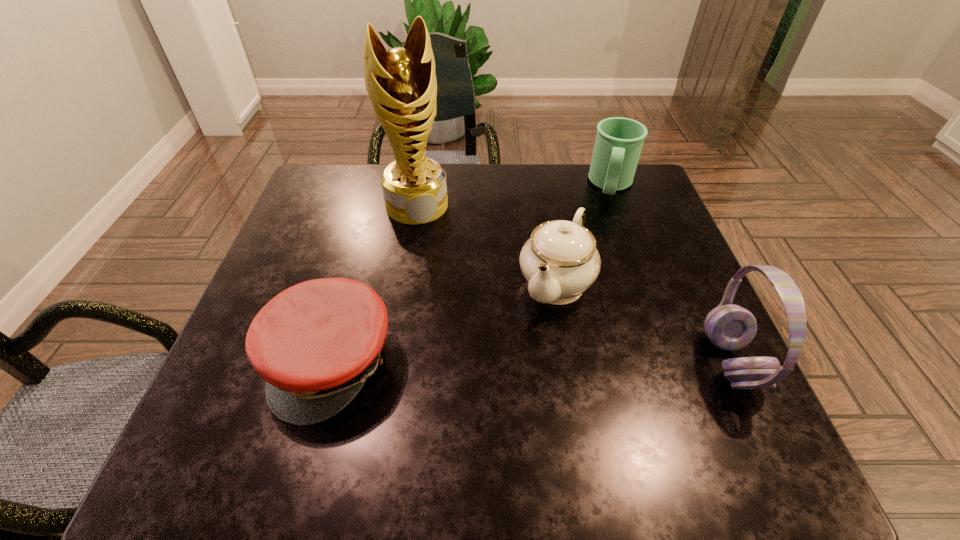
Locate an element on the screen. vacant area situated on the side of the mug with the handle is located at coordinates (601, 287).

Where is `free space located 0.060m on the front-facing side of the tallest object`? This screenshot has height=540, width=960. free space located 0.060m on the front-facing side of the tallest object is located at coordinates (429, 239).

Locate an element on the screen. The height and width of the screenshot is (540, 960). vacant region located on the front-facing side of the tallest object is located at coordinates (443, 275).

Where is `vacant area situated 0.300m on the front-facing side of the tallest object`? This screenshot has width=960, height=540. vacant area situated 0.300m on the front-facing side of the tallest object is located at coordinates (455, 310).

Find the location of `vacant space situated at the spout of the third object from left to right`. vacant space situated at the spout of the third object from left to right is located at coordinates (532, 335).

You are a GUI agent. You are given a task and a screenshot of the screen. Output one action in this format:
    pyautogui.click(x=<x>, y=<y>)
    Task: Click on the free point located at the spout of the third object from left to right
    This screenshot has width=960, height=540.
    Given the screenshot: What is the action you would take?
    pyautogui.click(x=498, y=395)

You are a GUI agent. You are given a task and a screenshot of the screen. Output one action in this format:
    pyautogui.click(x=<x>, y=<y>)
    Task: Click on the blank space located 0.100m at the spout of the third object from left to right
    
    Given the screenshot: What is the action you would take?
    pyautogui.click(x=522, y=353)

Where is `mug present at the far edge`? This screenshot has height=540, width=960. mug present at the far edge is located at coordinates (619, 141).

The image size is (960, 540). Identify the location of award that is positioned at the far edge. (401, 83).

What are the coordinates of `cap present at the near edge` in the screenshot? It's located at (316, 343).